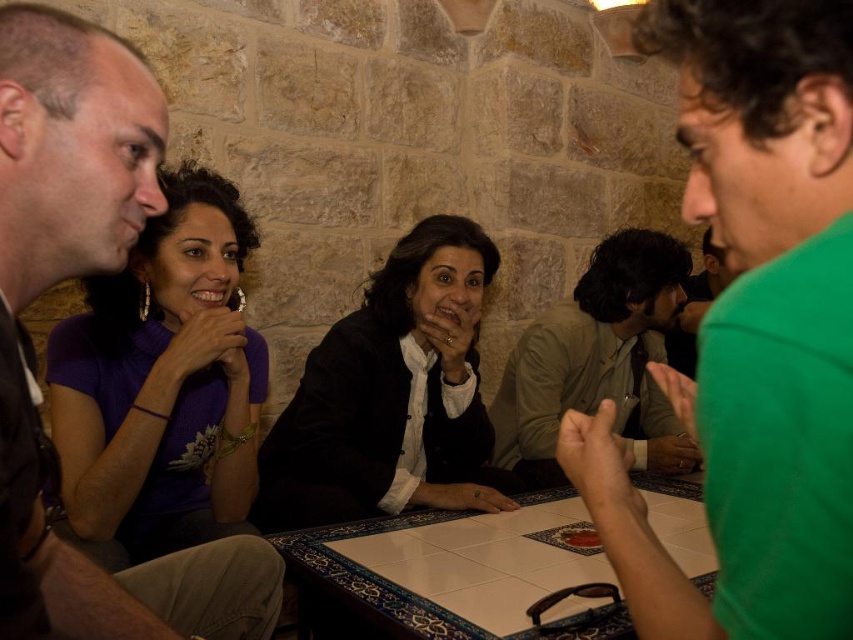
Question: Can you confirm if green matte shirt at center is positioned to the left of khaki cotton shirt at center?

Choices:
 (A) no
 (B) yes

Answer: (B)

Question: Which is farther from the matte black jacket at center?

Choices:
 (A) khaki cotton shirt at center
 (B) green matte shirt at center
 (C) white tile table at center
 (D) purple matte shirt at left

Answer: (B)

Question: Based on their relative distances, which object is nearer to the purple matte shirt at left?

Choices:
 (A) matte black jacket at center
 (B) khaki cotton shirt at center
 (C) white tile table at center

Answer: (A)

Question: Among these objects, which one is nearest to the camera?

Choices:
 (A) purple matte shirt at left
 (B) green matte shirt at center
 (C) khaki cotton shirt at center

Answer: (B)

Question: Does white tile table at center have a lesser width compared to khaki cotton shirt at center?

Choices:
 (A) yes
 (B) no

Answer: (B)

Question: Does green matte shirt at center have a lesser width compared to matte black jacket at center?

Choices:
 (A) no
 (B) yes

Answer: (B)